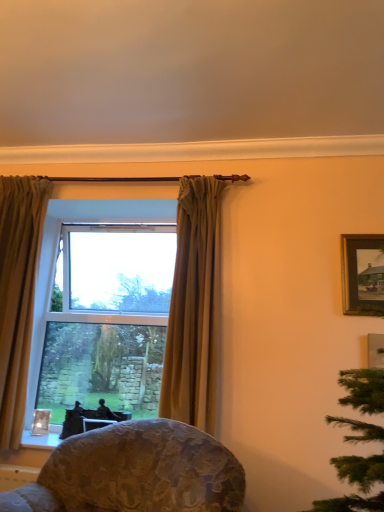
Question: From their relative heights in the image, would you say gold textured curtain at left, the first curtain positioned from the left, is taller or shorter than wooden framed painting at upper right?

Choices:
 (A) short
 (B) tall

Answer: (B)

Question: From the image's perspective, relative to wooden framed painting at upper right, is gold textured curtain at left, arranged as the 2th curtain when viewed from the right, above or below?

Choices:
 (A) above
 (B) below

Answer: (B)

Question: Based on their relative distances, which object is farther from the gold textured curtain at left, the first curtain positioned from the left?

Choices:
 (A) wooden framed painting at upper right
 (B) floral fabric chair at lower center
 (C) clear glass window at center
 (D) matte gold curtain at center, marked as the 1th curtain in a right-to-left arrangement

Answer: (A)

Question: Which object is the closest to the gold textured curtain at left, arranged as the 2th curtain when viewed from the right?

Choices:
 (A) matte gold curtain at center, the 2th curtain positioned from the left
 (B) clear glass window at center
 (C) floral fabric chair at lower center
 (D) wooden framed painting at upper right

Answer: (B)